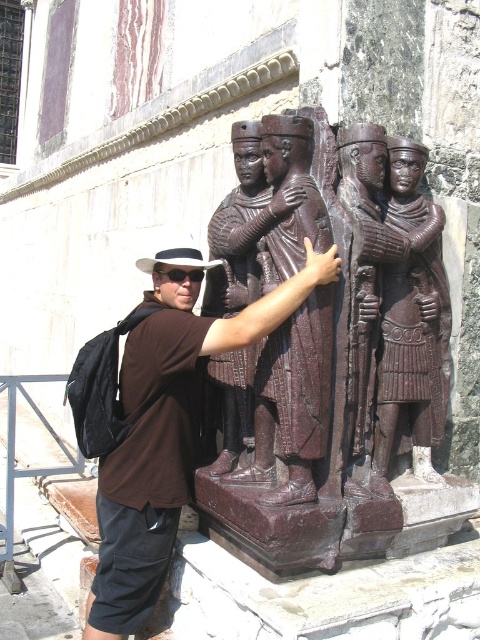
Question: Which point is closer to the camera?

Choices:
 (A) (180, 280)
 (B) (160, 467)
 (C) (328, 436)
 (D) (407, 320)

Answer: (C)

Question: Among these objects, which one is nearest to the camera?

Choices:
 (A) black plastic goggles at upper center
 (B) brown polished wood statue at center
 (C) brown marble statue at center

Answer: (C)

Question: Does brown matte shirt at center lie in front of black plastic goggles at upper center?

Choices:
 (A) yes
 (B) no

Answer: (A)

Question: Where is brown matte shirt at center located in relation to brown polished wood statue at center in the image?

Choices:
 (A) above
 (B) below

Answer: (B)

Question: Where is brown matte shirt at center located in relation to black plastic goggles at upper center in the image?

Choices:
 (A) below
 (B) above

Answer: (A)

Question: Among these points, which one is nearest to the camera?

Choices:
 (A) (392, 192)
 (B) (194, 269)
 (C) (151, 596)

Answer: (C)